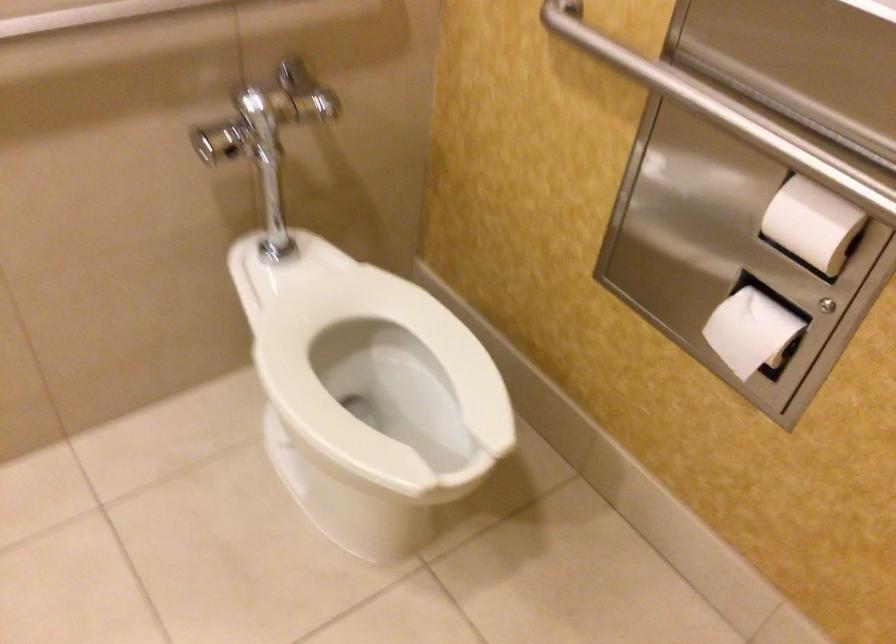
Find the location of `white toilet seat`. white toilet seat is located at coordinates (380, 381).